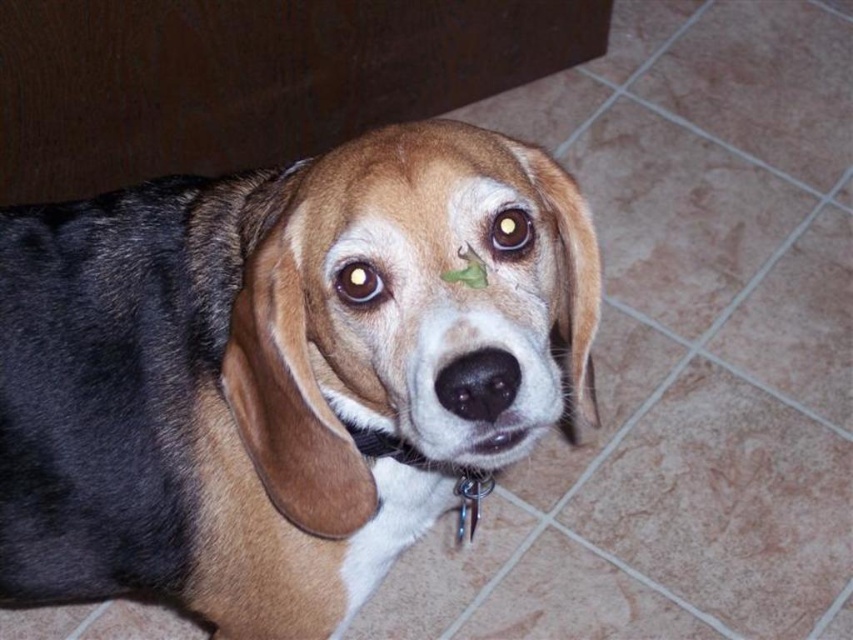
You are a photographer adjusting your camera settings to focus on the metallic chain at center and the brown glossy eye at center. Which object should you focus on first to ensure proper depth of field?

The metallic chain at center is further to the viewer than the brown glossy eye at center, so you should focus on the metallic chain at center first to ensure proper depth of field.

In the scene shown: You are a dog breeder assessing the health of the Beagle in the image. You notice the metallic chain at center and the brown glossy eye at center. Which object has a greater width?

The metallic chain at center has a greater width than the brown glossy eye at center.

You are a veterinarian examining a Beagle dog. The dog has a small green leaf stuck to its nose. You need to locate a specific point on the dog for a minor procedure. The point is at coordinates point (364, 236). Where exactly is this point located on the dog?

The point (364, 236) corresponds to the brown fur eyebrow at upper center.